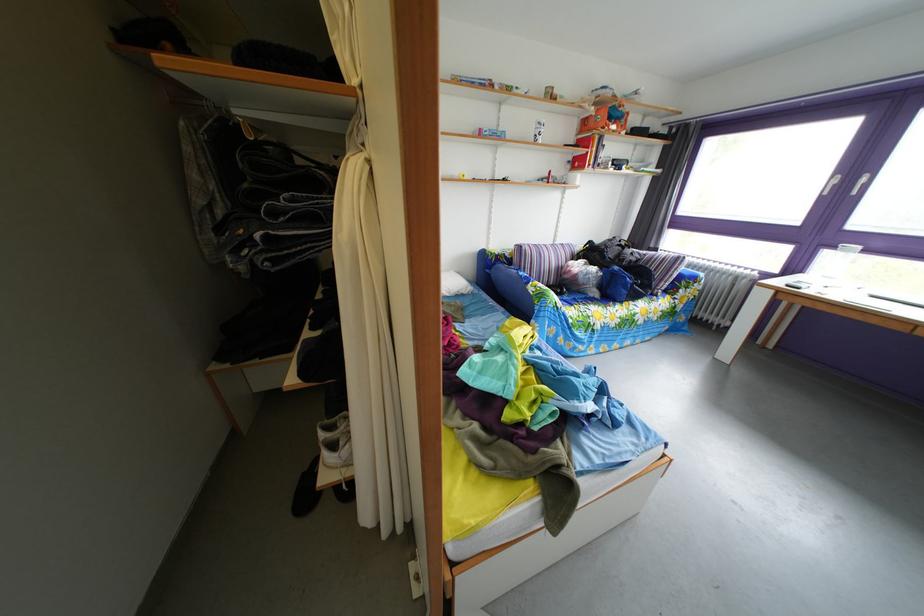
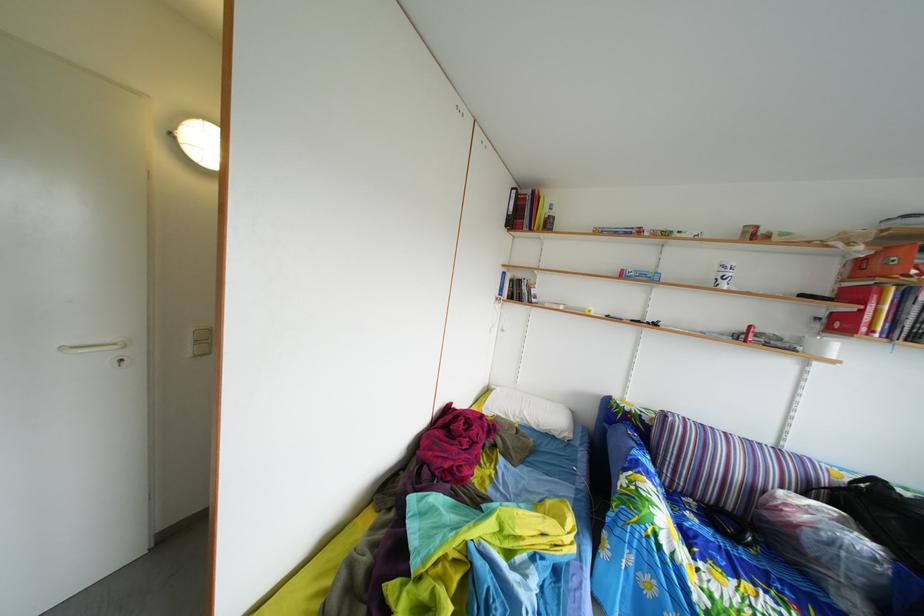
The point at (459, 301) is marked in the first image. Where is the corresponding point in the second image?

(549, 434)